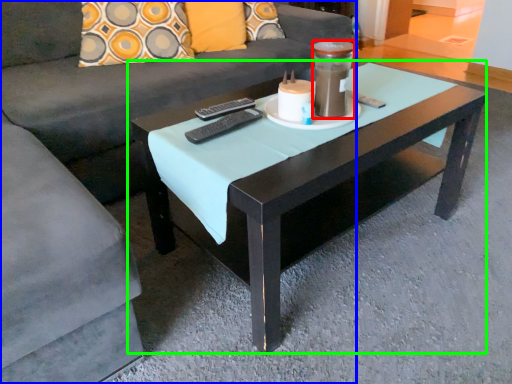
Question: Which is farther away from beverage (highlighted by a red box)? studio couch (highlighted by a blue box) or coffee table (highlighted by a green box)?

Choices:
 (A) studio couch
 (B) coffee table

Answer: (A)